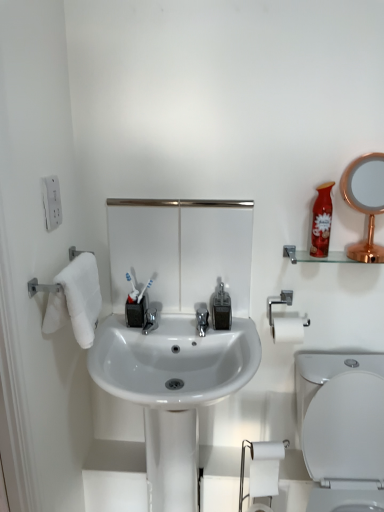
Question: Is white glossy toilet at lower right smaller than translucent plastic soap dispenser at center?

Choices:
 (A) no
 (B) yes

Answer: (A)

Question: Is white glossy toilet at lower right oriented towards translucent plastic soap dispenser at center?

Choices:
 (A) no
 (B) yes

Answer: (A)

Question: Is white glossy toilet at lower right in contact with translucent plastic soap dispenser at center?

Choices:
 (A) yes
 (B) no

Answer: (B)

Question: Can we say white glossy toilet at lower right lies outside translucent plastic soap dispenser at center?

Choices:
 (A) yes
 (B) no

Answer: (A)

Question: From the image's perspective, is white glossy toilet at lower right over translucent plastic soap dispenser at center?

Choices:
 (A) no
 (B) yes

Answer: (A)

Question: From a real-world perspective, is white glossy toilet at lower right over translucent plastic soap dispenser at center?

Choices:
 (A) yes
 (B) no

Answer: (B)

Question: Does white glossy sink at center have a smaller size compared to translucent plastic soap dispenser at center?

Choices:
 (A) yes
 (B) no

Answer: (B)

Question: Can you confirm if white glossy sink at center is taller than translucent plastic soap dispenser at center?

Choices:
 (A) no
 (B) yes

Answer: (B)

Question: Is white glossy sink at center with translucent plastic soap dispenser at center?

Choices:
 (A) no
 (B) yes

Answer: (A)

Question: From the image's perspective, is white glossy sink at center located beneath translucent plastic soap dispenser at center?

Choices:
 (A) no
 (B) yes

Answer: (B)

Question: Can you confirm if white glossy sink at center is bigger than translucent plastic soap dispenser at center?

Choices:
 (A) no
 (B) yes

Answer: (B)

Question: Is white glossy sink at center oriented towards translucent plastic soap dispenser at center?

Choices:
 (A) yes
 (B) no

Answer: (B)

Question: Is white matte toilet paper at lower right inside white glossy sink at center?

Choices:
 (A) no
 (B) yes

Answer: (B)